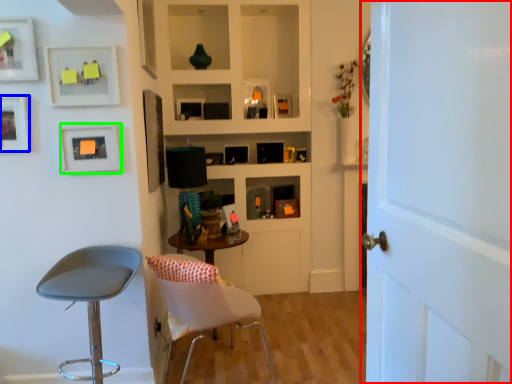
Question: Which is nearer to the door (highlighted by a red box)? picture frame (highlighted by a blue box) or picture frame (highlighted by a green box).

Choices:
 (A) picture frame
 (B) picture frame

Answer: (B)